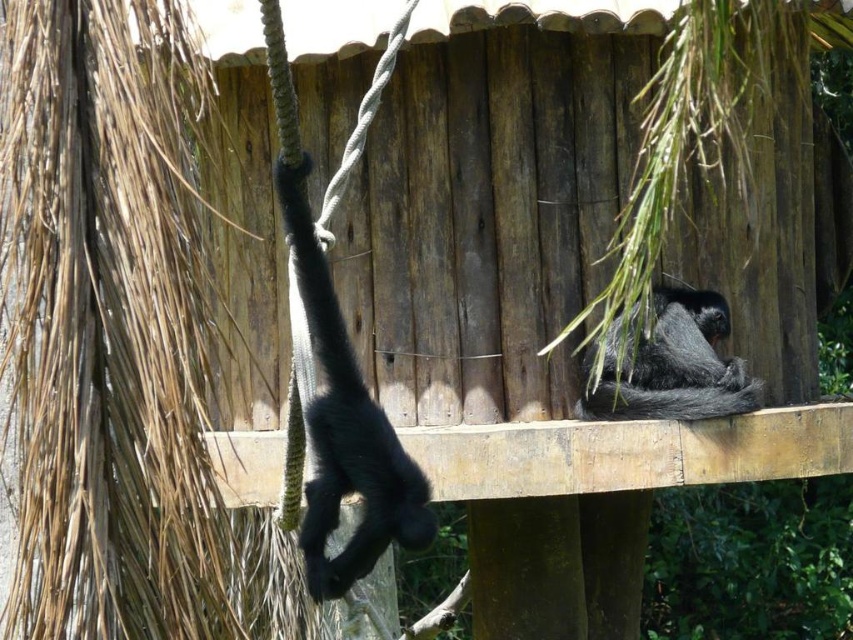
Does black matte/glossy monkey at left have a smaller size compared to shiny black monkey at center?

Yes, black matte/glossy monkey at left is smaller than shiny black monkey at center.

Is point (432, 525) in front of point (721, 412)?

That is True.

In order to click on black matte/glossy monkey at left in this screenshot , I will do `click(345, 428)`.